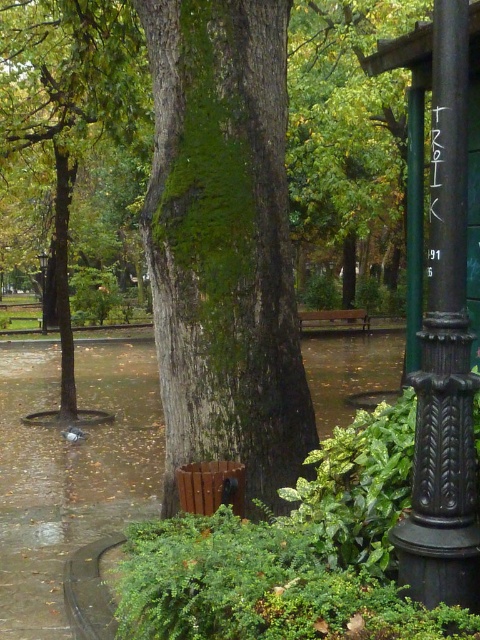
Does green polished metal pole at right have a lesser height compared to brown wooden bench at center?

No.

Find the location of a particular element. The width and height of the screenshot is (480, 640). green polished metal pole at right is located at coordinates (414, 227).

Is point (415, 184) positioned after point (314, 321)?

No.

At what (x,y) coordinates should I click in order to perform the action: click on green polished metal pole at right. Please return your answer as a coordinate pair (x, y). Looking at the image, I should click on (414, 227).

Can you confirm if brown wooden bench at center is shorter than metallic pole at center?

Correct, brown wooden bench at center is not as tall as metallic pole at center.

Image resolution: width=480 pixels, height=640 pixels. Describe the element at coordinates (335, 317) in the screenshot. I see `brown wooden bench at center` at that location.

Where is `brown wooden bench at center`? brown wooden bench at center is located at coordinates (335, 317).

In the scene shown: Does green mossy tree trunk at center appear on the left side of brown wooden bench at center?

Yes, green mossy tree trunk at center is to the left of brown wooden bench at center.

Consider the image. Between green mossy tree trunk at center and brown wooden bench at center, which one appears on the left side from the viewer's perspective?

Positioned to the left is green mossy tree trunk at center.

Where is `green mossy tree trunk at center`? The width and height of the screenshot is (480, 640). green mossy tree trunk at center is located at coordinates (225, 243).